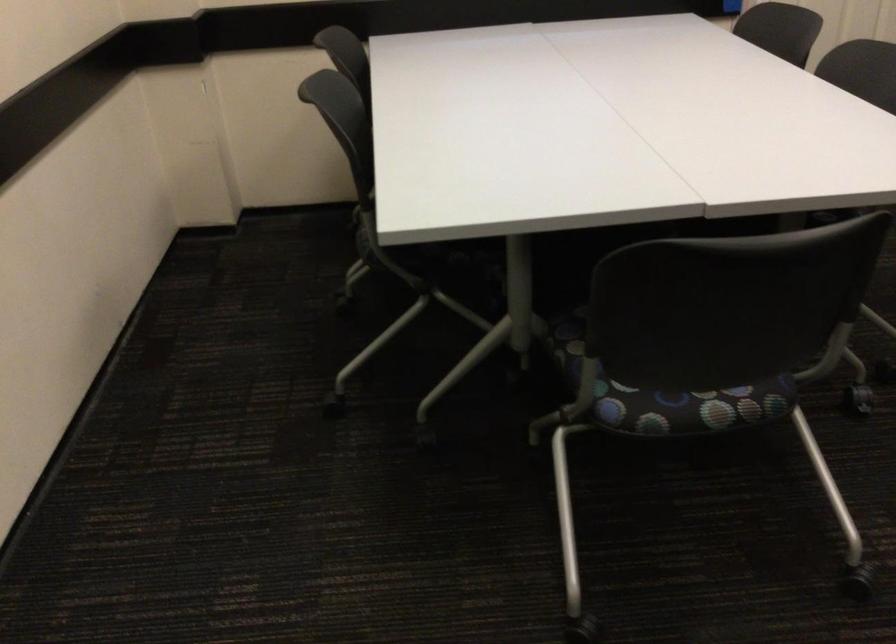
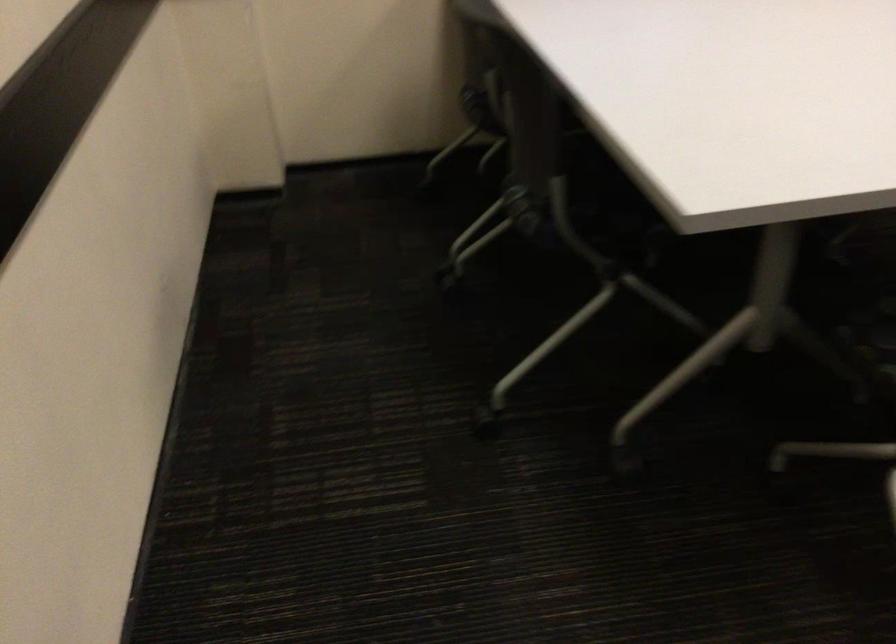
Question: The first image is from the beginning of the video and the second image is from the end. How did the camera likely rotate when shooting the video?

Choices:
 (A) Left
 (B) Right
 (C) Up
 (D) Down

Answer: (D)